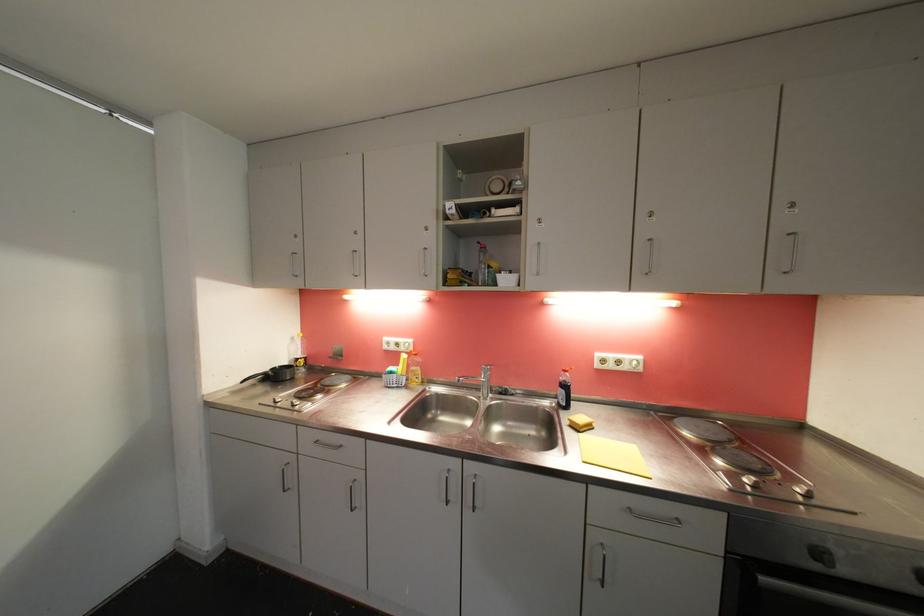
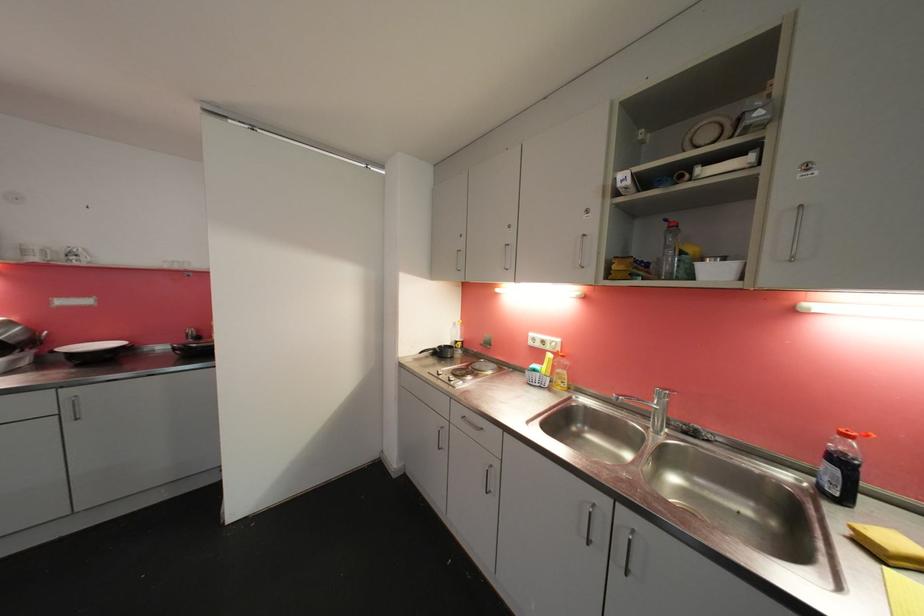
The point at [570,379] is marked in the first image. Where is the corresponding point in the second image?

(850, 450)